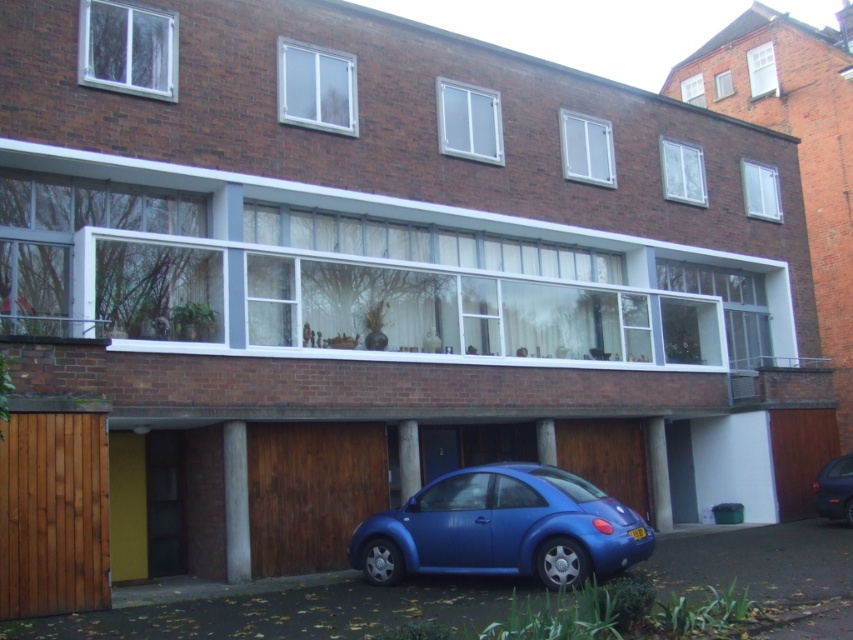
In the scene shown: You are standing at the entrance of the building and want to park your car. The parking spot is marked by the point at (502, 529). Is the blue metallic car at lower center currently occupying the parking spot?

The blue metallic car at lower center is represented by point (502, 529), so yes, the blue metallic car at lower center is currently occupying the parking spot marked by that point.